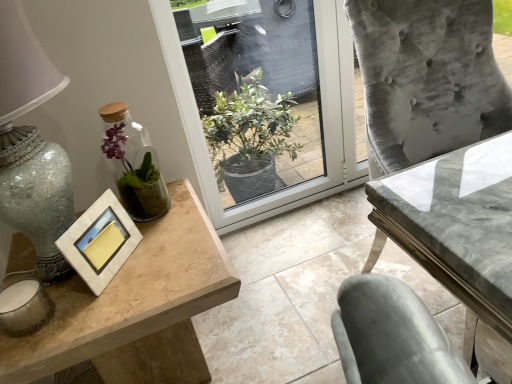
You are a GUI agent. You are given a task and a screenshot of the screen. Output one action in this format:
    pyautogui.click(x=<x>, y=<y>)
    Task: Click on the vacant space to the right of clear glass vase at left
    Image resolution: width=512 pixels, height=384 pixels.
    Given the screenshot: What is the action you would take?
    pyautogui.click(x=190, y=215)